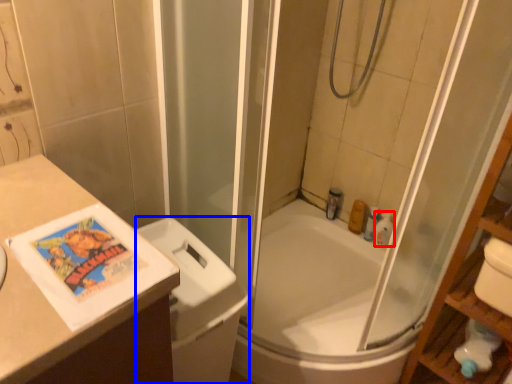
Question: Which of the following is the closest to the observer, toiletry (highlighted by a red box) or toilet bowl (highlighted by a blue box)?

Choices:
 (A) toiletry
 (B) toilet bowl

Answer: (B)